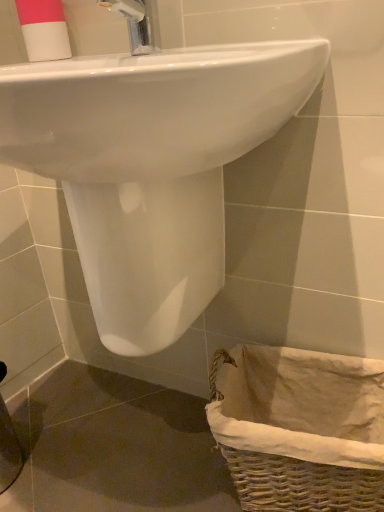
Question: Looking at their shapes, would you say pink matte cup at upper left is wider or thinner than white glossy sink at upper center?

Choices:
 (A) thin
 (B) wide

Answer: (A)

Question: Visually, is pink matte cup at upper left positioned to the left or to the right of white glossy sink at upper center?

Choices:
 (A) left
 (B) right

Answer: (A)

Question: Which object is positioned farthest from the woven wicker basket at lower right?

Choices:
 (A) white glossy sink at upper center
 (B) pink matte cup at upper left

Answer: (B)

Question: Based on their relative distances, which object is farther from the white glossy sink at upper center?

Choices:
 (A) woven wicker basket at lower right
 (B) pink matte cup at upper left

Answer: (B)